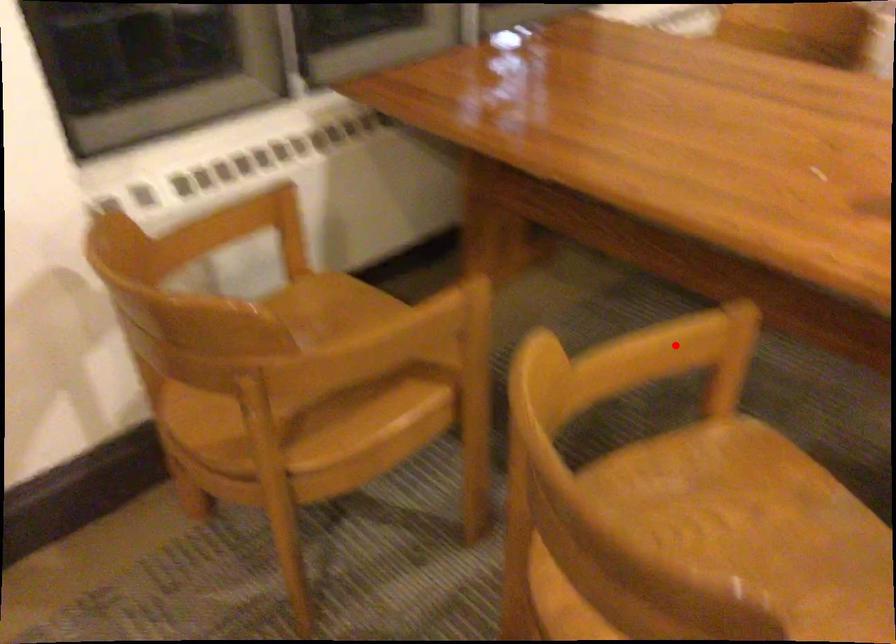
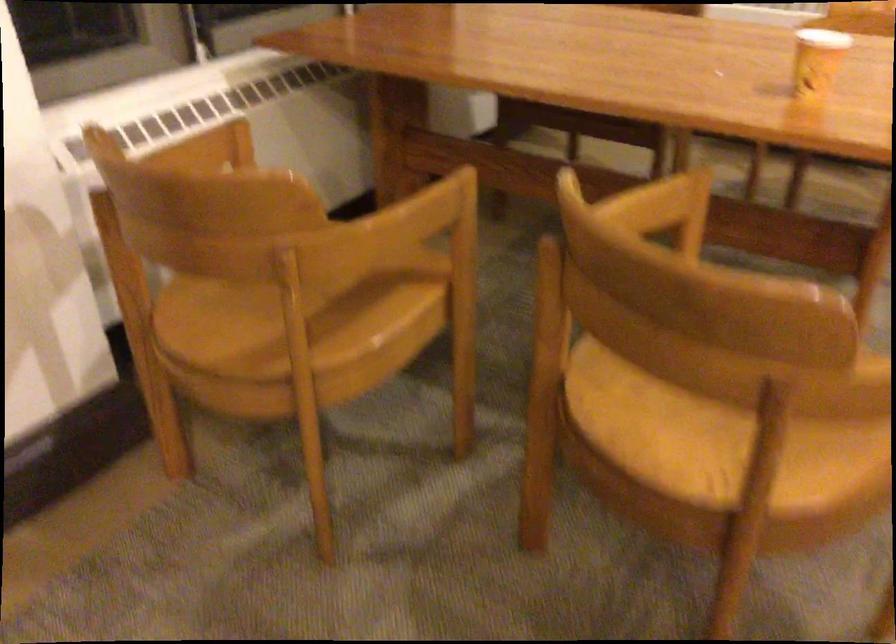
Question: I am providing you with two images of the same scene from different viewpoints. Image1 has a red point marked. In image2, the corresponding 3D location appears at what relative position? Reply with the corresponding letter.

Choices:
 (A) Closer
 (B) Farther

Answer: (B)